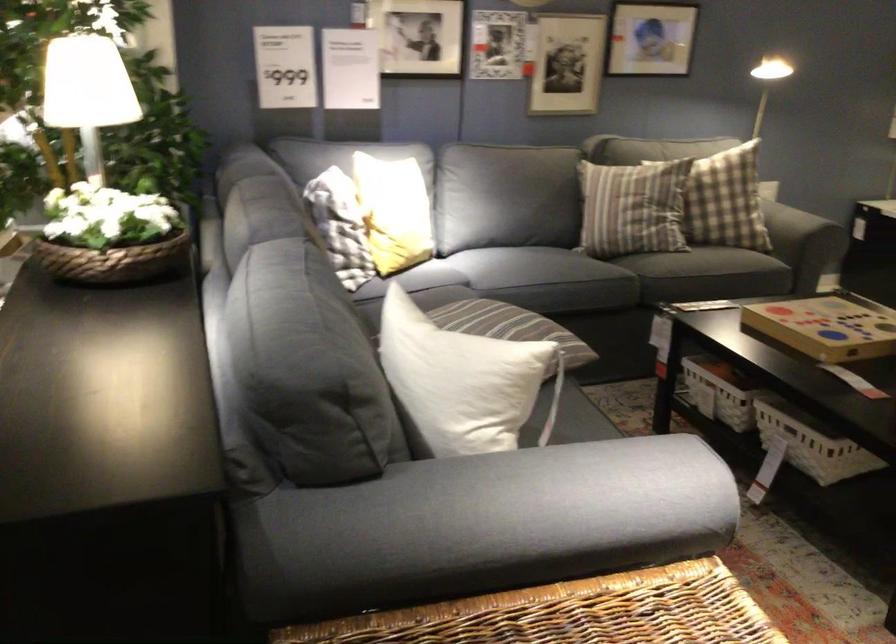
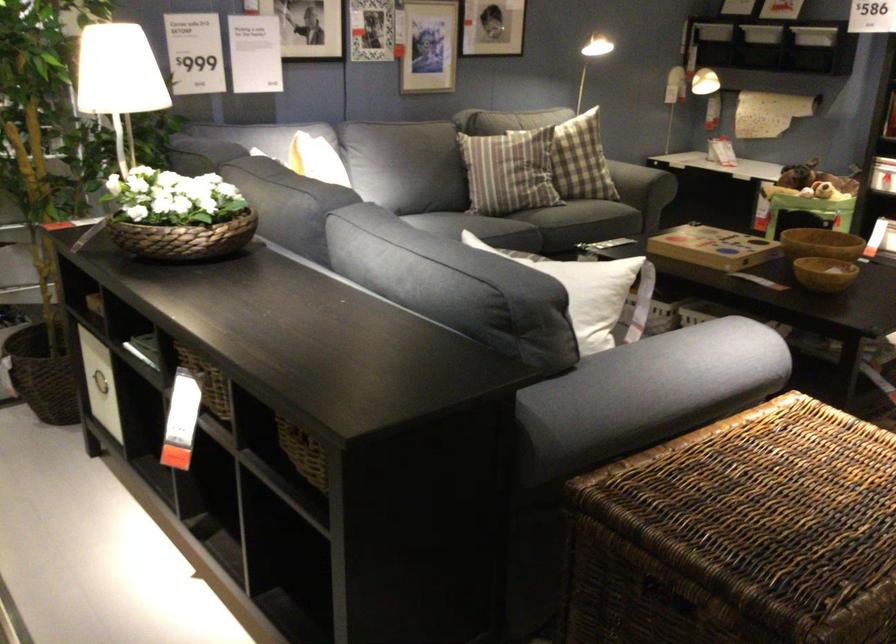
Question: I am providing you with two images of the same scene from different viewpoints. Which of the following objects are not visible in image2?

Choices:
 (A) wicker storage basket
 (B) wooden bowl
 (C) white storage basket
 (D) black plastic spoon

Answer: (C)